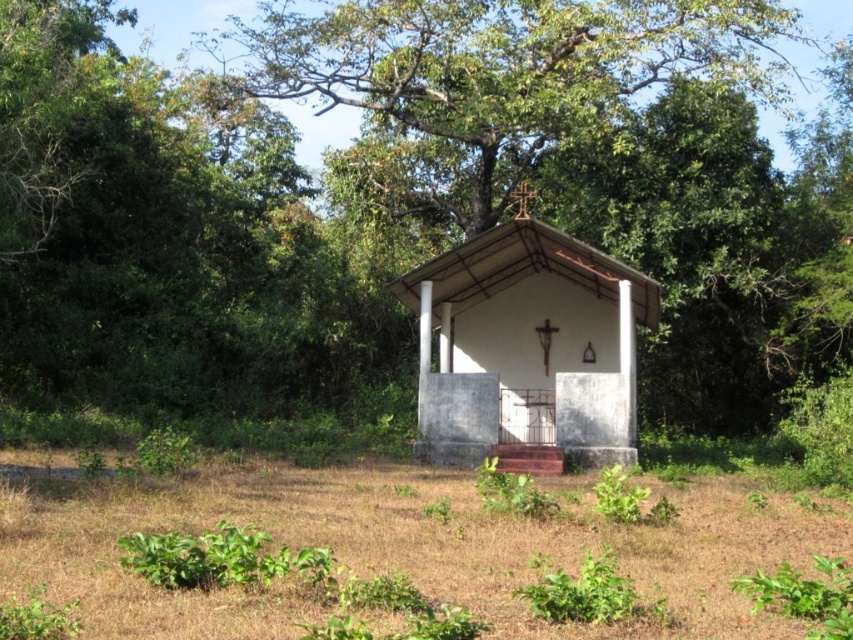
Question: Which point appears farthest from the camera in this image?

Choices:
 (A) (537, 3)
 (B) (97, 499)

Answer: (A)

Question: Where is brown dry grass at center located in relation to white concrete hut at center in the image?

Choices:
 (A) above
 (B) below

Answer: (B)

Question: Is green leafy tree at center behind white concrete hut at center?

Choices:
 (A) no
 (B) yes

Answer: (B)

Question: Is the position of green leafy tree at center more distant than that of brown dry grass at center?

Choices:
 (A) yes
 (B) no

Answer: (A)

Question: Which object appears closest to the camera in this image?

Choices:
 (A) brown dry grass at center
 (B) green leafy tree at center

Answer: (A)

Question: Which object is farther from the camera taking this photo?

Choices:
 (A) brown dry grass at center
 (B) green leafy tree at center

Answer: (B)